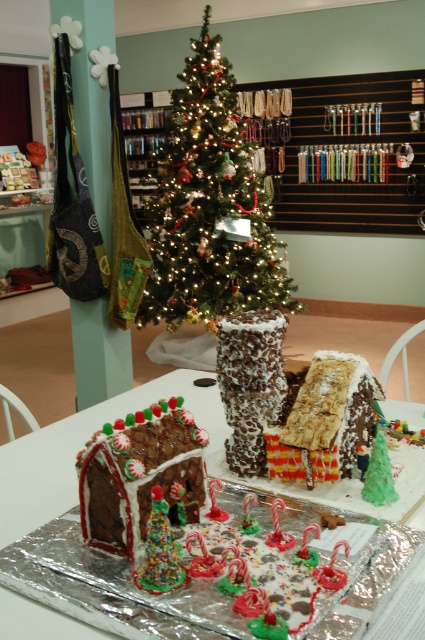
Question: Considering the relative positions of chocolate cake at center and chocolate-frosted gingerbread house at center in the image provided, where is chocolate cake at center located with respect to chocolate-frosted gingerbread house at center?

Choices:
 (A) below
 (B) above

Answer: (A)

Question: Which of the following is the closest to the observer?

Choices:
 (A) chocolate frosted gingerbread house at center
 (B) chocolate-frosted gingerbread house at center
 (C) chocolate cake at center
 (D) green matte christmas tree at center

Answer: (C)

Question: Is green matte christmas tree at center smaller than chocolate frosted gingerbread house at center?

Choices:
 (A) no
 (B) yes

Answer: (A)

Question: Does chocolate cake at center appear over chocolate-frosted gingerbread house at center?

Choices:
 (A) yes
 (B) no

Answer: (B)

Question: Which point is farther to the camera?

Choices:
 (A) (280, 352)
 (B) (209, 204)
 (C) (28, 493)
 (D) (169, 474)

Answer: (B)

Question: Which point appears farthest from the camera in this image?

Choices:
 (A) (85, 452)
 (B) (354, 449)
 (C) (164, 291)
 (D) (419, 468)

Answer: (C)